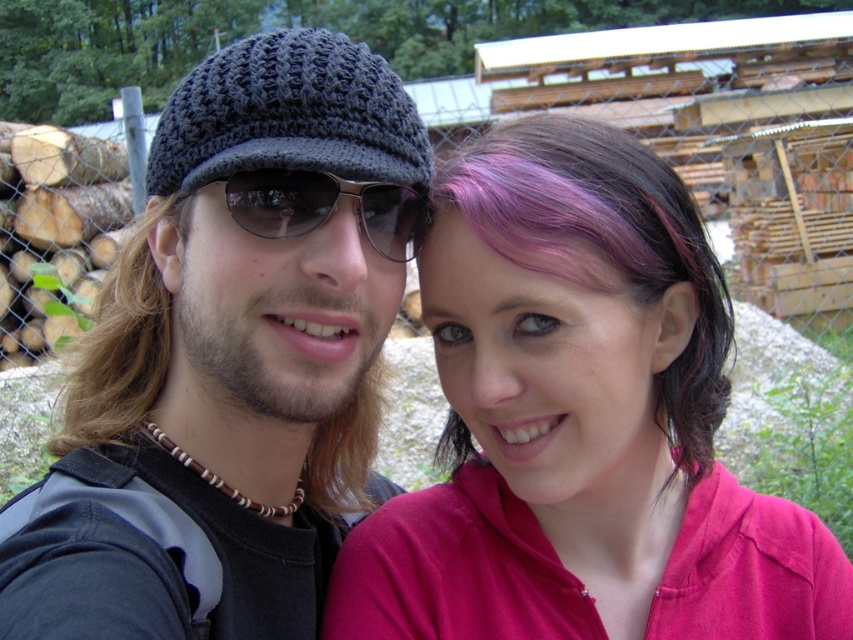
Is the position of pink hair at center less distant than that of sunglasses at center?

Yes, pink hair at center is closer to the viewer.

Between pink hair at center and sunglasses at center, which one appears on the left side from the viewer's perspective?

sunglasses at center

Who is more forward, (451, 541) or (314, 193)?

Point (314, 193) is more forward.

The image size is (853, 640). I want to click on pink hair at center, so click(579, 422).

Does pink hair at center have a greater height compared to brownwoollyhat at left?

Correct, pink hair at center is much taller as brownwoollyhat at left.

Does pink hair at center appear over brownwoollyhat at left?

Incorrect, pink hair at center is not positioned above brownwoollyhat at left.

Who is more forward, (x=477, y=227) or (x=142, y=336)?

Point (x=477, y=227) is in front.

You are a GUI agent. You are given a task and a screenshot of the screen. Output one action in this format:
    pyautogui.click(x=<x>, y=<y>)
    Task: Click on the pink hair at center
    This screenshot has width=853, height=640.
    Given the screenshot: What is the action you would take?
    pyautogui.click(x=579, y=422)

Can you confirm if knitted dark gray beanie at left is positioned above pink hair at center?

Actually, knitted dark gray beanie at left is below pink hair at center.

Does knitted dark gray beanie at left appear under pink hair at center?

Yes.

The image size is (853, 640). Describe the element at coordinates (231, 358) in the screenshot. I see `knitted dark gray beanie at left` at that location.

I want to click on knitted dark gray beanie at left, so click(x=231, y=358).